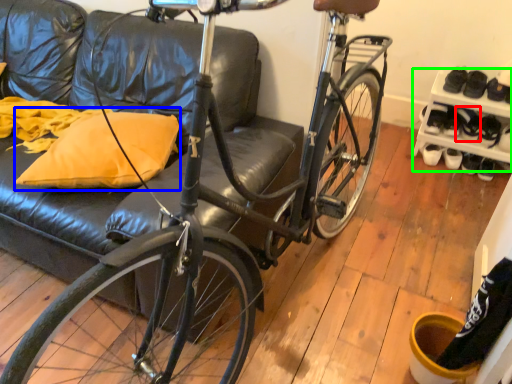
Question: Which is nearer to the shoe (highlighted by a red box)? throw pillow (highlighted by a blue box) or shelf (highlighted by a green box).

Choices:
 (A) throw pillow
 (B) shelf

Answer: (B)